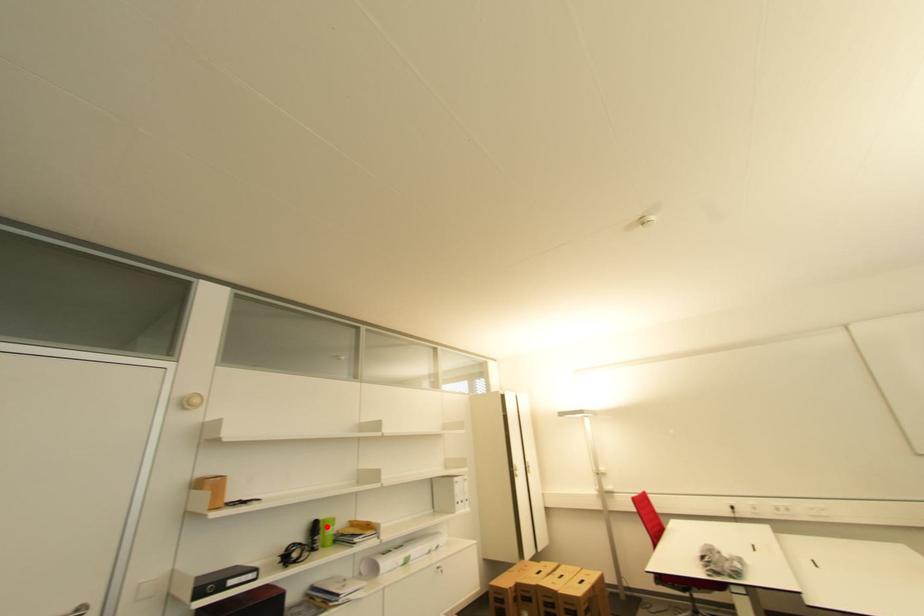
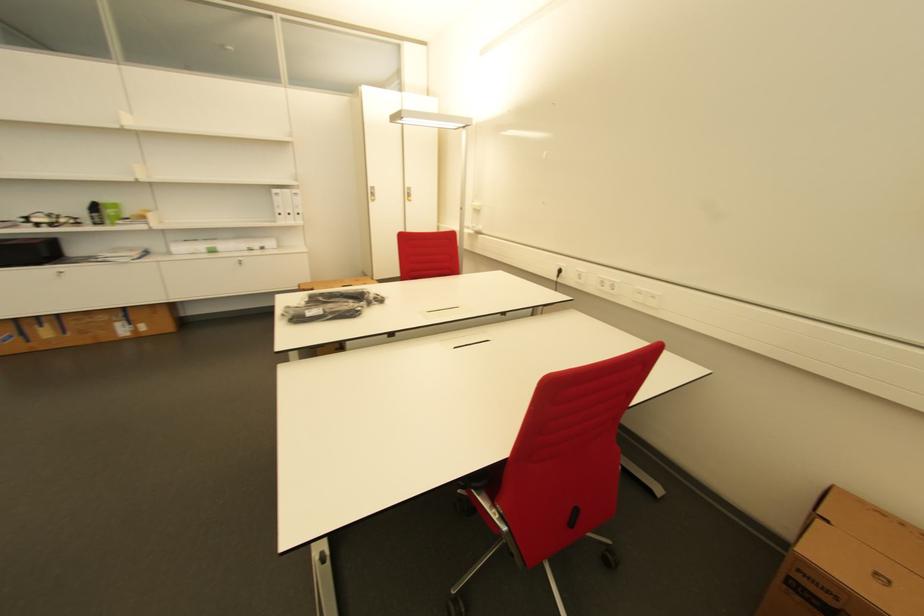
Locate, in the second image, the point that corresponds to the highlighted location in the first image.

(104, 208)